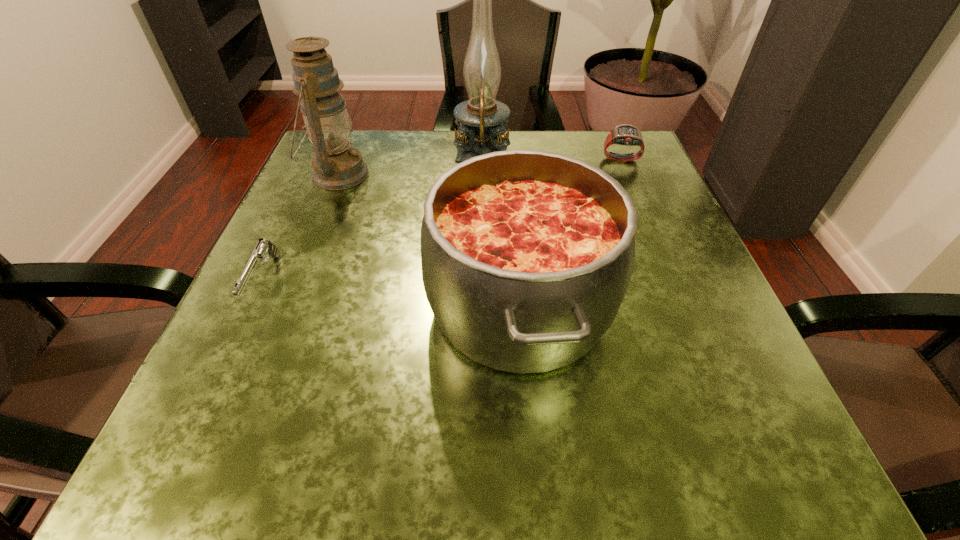
The height and width of the screenshot is (540, 960). I want to click on the second closest object to the pistol, so click(526, 255).